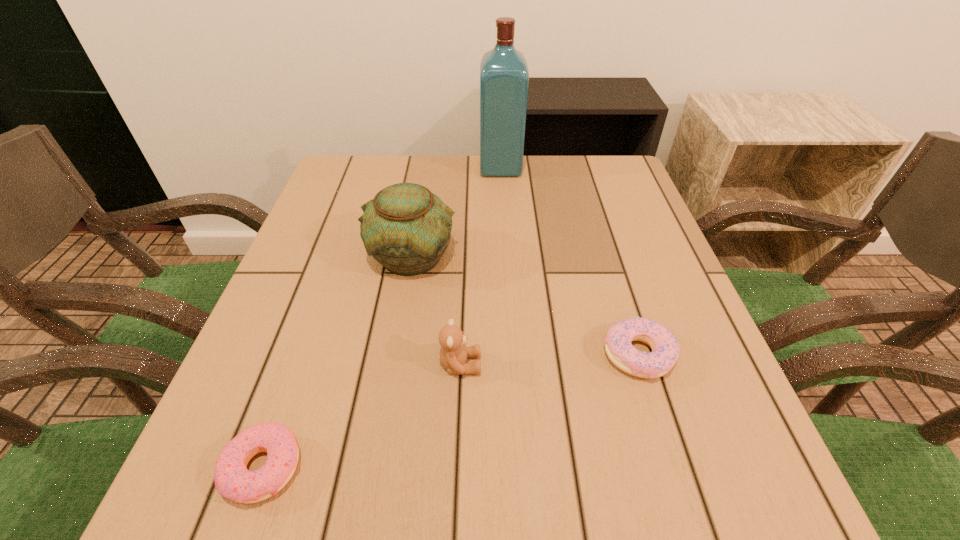
At what (x,y) coordinates should I click in order to perform the action: click on free space between the farther doughnut and the nearer doughnut. Please return your answer as a coordinate pair (x, y). This screenshot has width=960, height=540. Looking at the image, I should click on (451, 411).

Identify the location of vacant region between the pottery and the tallest object. (457, 212).

I want to click on free space between the farther doughnut and the left doughnut, so click(x=451, y=411).

Where is `vacant area that lies between the leftmost object and the teddy bear`? vacant area that lies between the leftmost object and the teddy bear is located at coordinates (362, 416).

Find the location of a particular element. The image size is (960, 540). free spot between the teddy bear and the farthest object is located at coordinates (480, 266).

Where is `vacant space that's between the third shortest object and the second farthest object`? vacant space that's between the third shortest object and the second farthest object is located at coordinates (436, 310).

Locate an element on the screen. free spot between the right doughnut and the teddy bear is located at coordinates (549, 360).

Locate an element on the screen. The height and width of the screenshot is (540, 960). free space between the rightmost object and the second farthest object is located at coordinates (x=525, y=305).

Choose which object is the second nearest neighbor to the farthest object. Please provide its 2D coordinates. Your answer should be formatted as a tuple, i.e. [(x, y)], where the tuple contains the x and y coordinates of a point satisfying the conditions above.

[(665, 349)]

Identify the location of object that is the closest to the liquor. Image resolution: width=960 pixels, height=540 pixels. (406, 228).